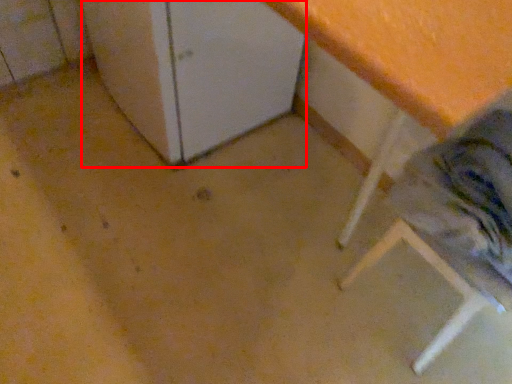
Question: Where is leftover (annotated by the red box) located in relation to step stool in the image?

Choices:
 (A) right
 (B) left

Answer: (B)